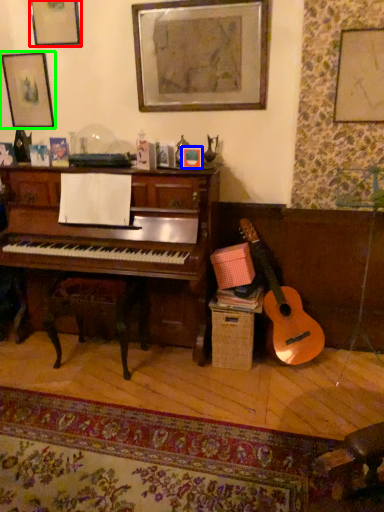
Question: Which object is the closest to the picture frame (highlighted by a red box)? Choose among these: picture frame (highlighted by a blue box) or picture frame (highlighted by a green box).

Choices:
 (A) picture frame
 (B) picture frame

Answer: (B)